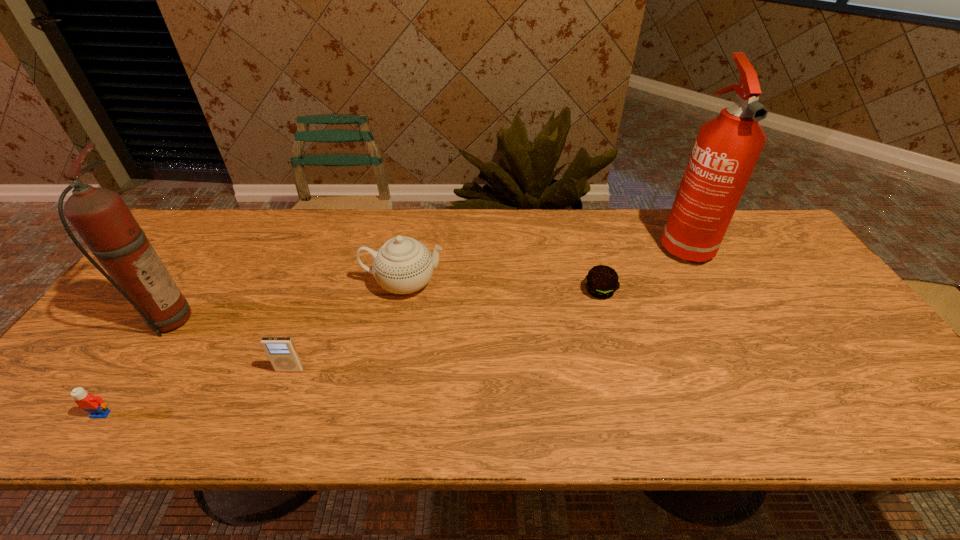
I want to click on Lego located in the left edge section of the desktop, so click(94, 405).

You are a GUI agent. You are given a task and a screenshot of the screen. Output one action in this format:
    pyautogui.click(x=<x>, y=<y>)
    Task: Click on the object located at the near left corner
    
    Given the screenshot: What is the action you would take?
    pyautogui.click(x=94, y=405)

Locate an element on the screen. This screenshot has height=540, width=960. free space at the far edge of the desktop is located at coordinates click(x=316, y=238).

Image resolution: width=960 pixels, height=540 pixels. In order to click on vacant space at the near edge of the desktop in this screenshot , I will do `click(271, 424)`.

This screenshot has width=960, height=540. In the image, there is a desktop. Find the location of `vacant space at the left edge`. vacant space at the left edge is located at coordinates (189, 258).

Find the location of `vacant point at the right edge`. vacant point at the right edge is located at coordinates (850, 345).

Where is `free space at the near right corner of the desktop`? free space at the near right corner of the desktop is located at coordinates (866, 426).

At what (x,y) coordinates should I click in order to perform the action: click on free point between the right fire extinguisher and the third object from left to right. Please return your answer as a coordinate pair (x, y). Looking at the image, I should click on (487, 306).

I want to click on vacant point located between the fifth shortest object and the shortest object, so click(x=383, y=305).

The height and width of the screenshot is (540, 960). What are the coordinates of `empty space that is in between the second nearest object and the shortest object` in the screenshot? It's located at (444, 330).